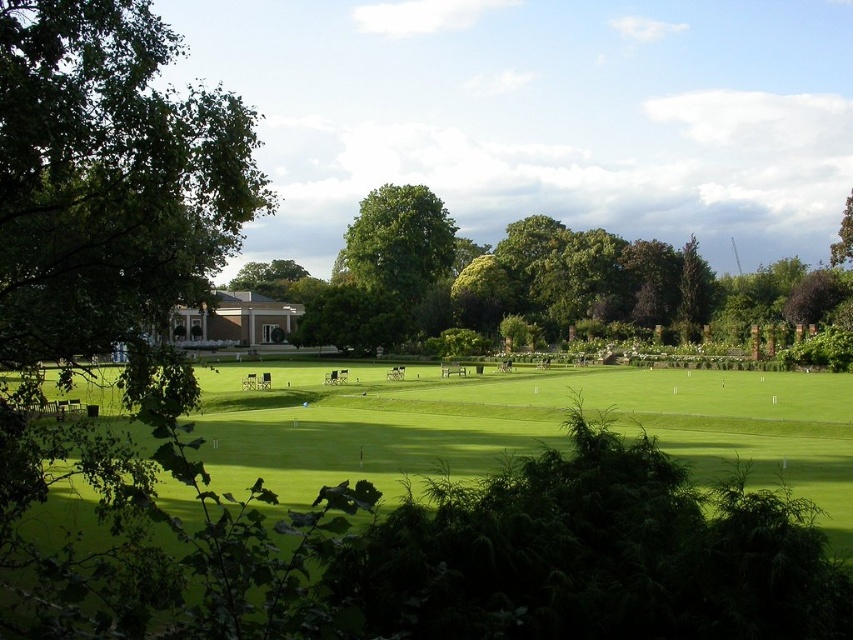
Question: Is green leafy tree at center positioned in front of green leafy tree at upper right?

Choices:
 (A) no
 (B) yes

Answer: (B)

Question: Which is nearer to the green grassy field at center?

Choices:
 (A) green leafy tree at upper right
 (B) green leafy tree at center

Answer: (B)

Question: Based on their relative distances, which object is nearer to the green leafy tree at center?

Choices:
 (A) green grassy field at center
 (B) green leafy tree at upper right

Answer: (A)

Question: Which object is closer to the camera taking this photo?

Choices:
 (A) green grassy field at center
 (B) green leafy tree at center

Answer: (A)

Question: Can you confirm if green grassy field at center is positioned above green leafy tree at upper right?

Choices:
 (A) no
 (B) yes

Answer: (A)

Question: Does green leafy tree at center have a greater width compared to green leafy tree at upper right?

Choices:
 (A) no
 (B) yes

Answer: (B)